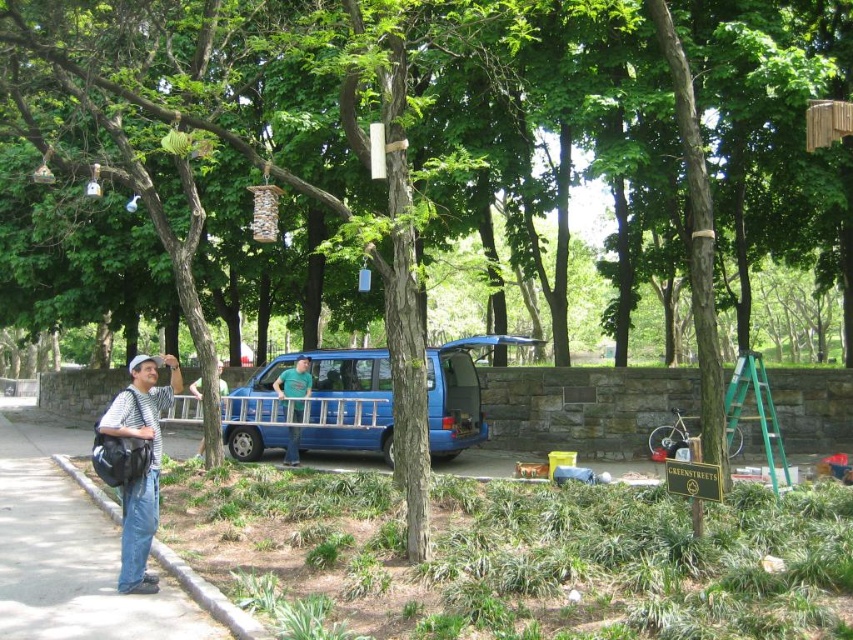
Question: Is striped cotton shirt at left smaller than gray concrete curb at lower left?

Choices:
 (A) yes
 (B) no

Answer: (B)

Question: Which of the following is the farthest from the observer?

Choices:
 (A) striped cotton shirt at left
 (B) green cotton shirt at center
 (C) blue matte van at center

Answer: (C)

Question: Among these objects, which one is nearest to the camera?

Choices:
 (A) green cotton shirt at center
 (B) gray concrete curb at lower left

Answer: (B)

Question: Among these points, which one is nearest to the camera?

Choices:
 (A) (138, 372)
 (B) (285, 371)
 (C) (262, 426)
 (D) (181, 557)

Answer: (A)

Question: In this image, where is blue matte van at center located relative to striped cotton shirt at left?

Choices:
 (A) above
 (B) below

Answer: (A)

Question: Is blue matte van at center wider than striped cotton shirt at left?

Choices:
 (A) yes
 (B) no

Answer: (B)